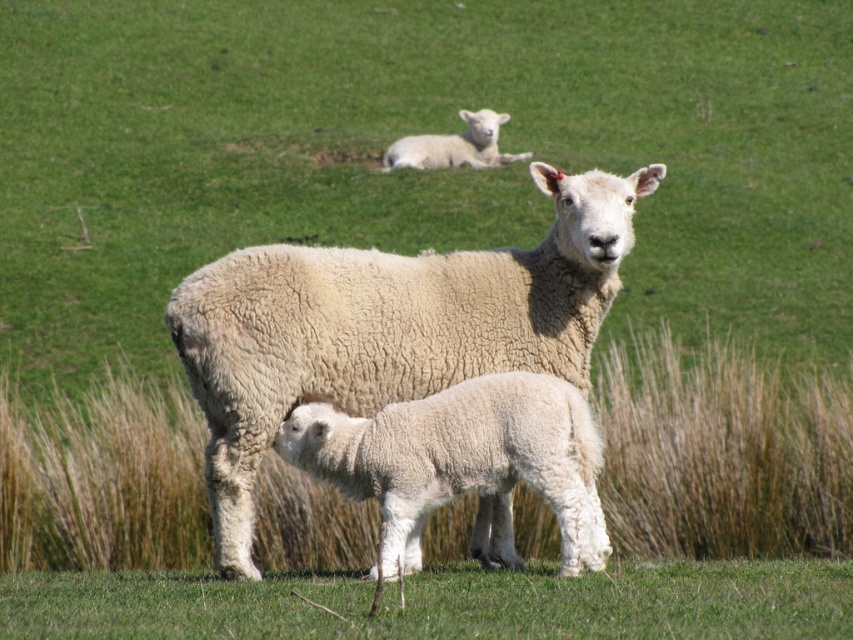
Is green soft grass at lower center above white woolen lamb at upper center?

Actually, green soft grass at lower center is below white woolen lamb at upper center.

Does green soft grass at lower center have a lesser height compared to white woolen lamb at upper center?

Indeed, green soft grass at lower center has a lesser height compared to white woolen lamb at upper center.

Who is more forward, (21, 637) or (479, 141)?

Positioned in front is point (21, 637).

Locate an element on the screen. green soft grass at lower center is located at coordinates (444, 604).

Is white woolen sheep at center above white woolen lamb at upper center?

No.

Which is more to the right, white woolen sheep at center or white woolen lamb at upper center?

white woolen sheep at center is more to the right.

Which is in front, point (604, 314) or point (479, 125)?

Positioned in front is point (604, 314).

Identify the location of white woolen sheep at center. The width and height of the screenshot is (853, 640). (387, 326).

Who is more forward, (584, 214) or (300, 464)?

Point (584, 214) is more forward.

Which of these two, white woolen sheep at center or white woolen lamb at center, stands shorter?

With less height is white woolen lamb at center.

This screenshot has height=640, width=853. Describe the element at coordinates (387, 326) in the screenshot. I see `white woolen sheep at center` at that location.

Image resolution: width=853 pixels, height=640 pixels. I want to click on white woolen sheep at center, so click(387, 326).